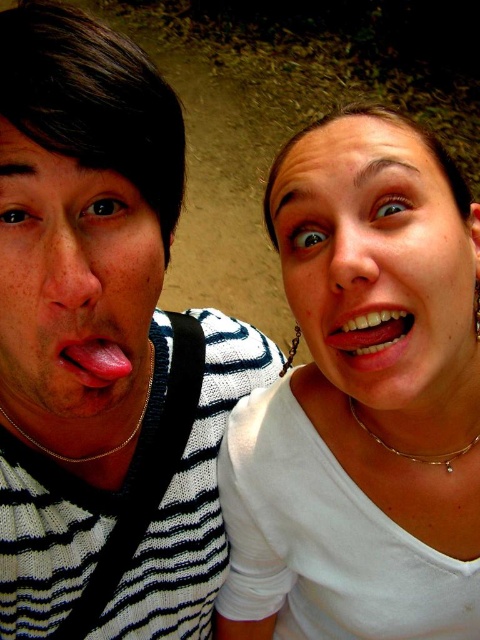
Question: Which of the following is the closest to the observer?

Choices:
 (A) glossy white teeth at center
 (B) matte skin face at left

Answer: (B)

Question: Which object appears closest to the camera in this image?

Choices:
 (A) smooth white face at center
 (B) smooth pink tongue at center

Answer: (B)

Question: Considering the relative positions of smooth white face at center and gold chain at left in the image provided, where is smooth white face at center located with respect to gold chain at left?

Choices:
 (A) below
 (B) above

Answer: (B)

Question: Considering the relative positions of smooth pink tongue at center and silver chain necklace at lower center in the image provided, where is smooth pink tongue at center located with respect to silver chain necklace at lower center?

Choices:
 (A) right
 (B) left

Answer: (B)

Question: Is striped knit sweater at left closer to the viewer compared to gold chain at left?

Choices:
 (A) no
 (B) yes

Answer: (B)

Question: Estimate the real-world distances between objects in this image. Which object is closer to the smooth white face at center?

Choices:
 (A) striped knit sweater at left
 (B) glossy white teeth at center
 (C) gold chain at left

Answer: (B)